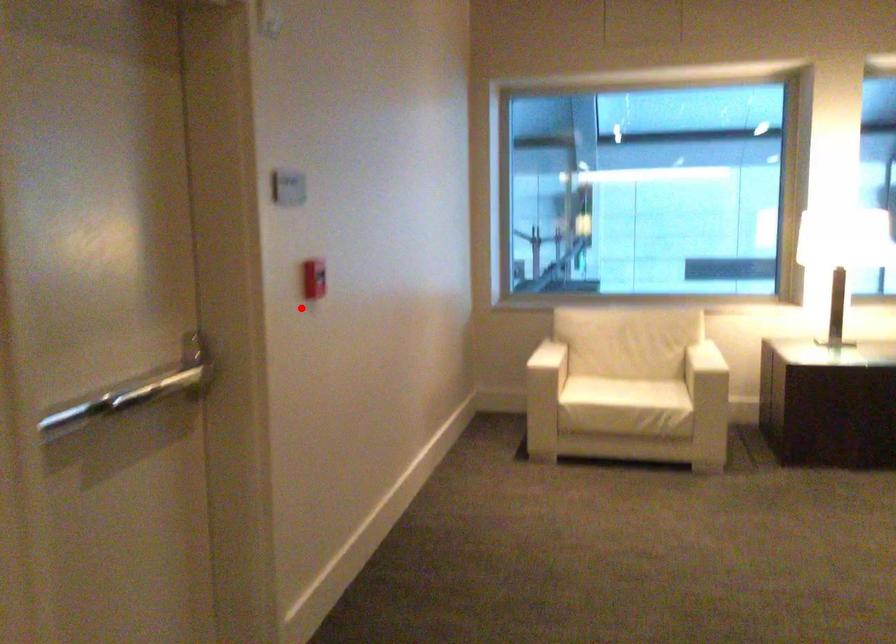
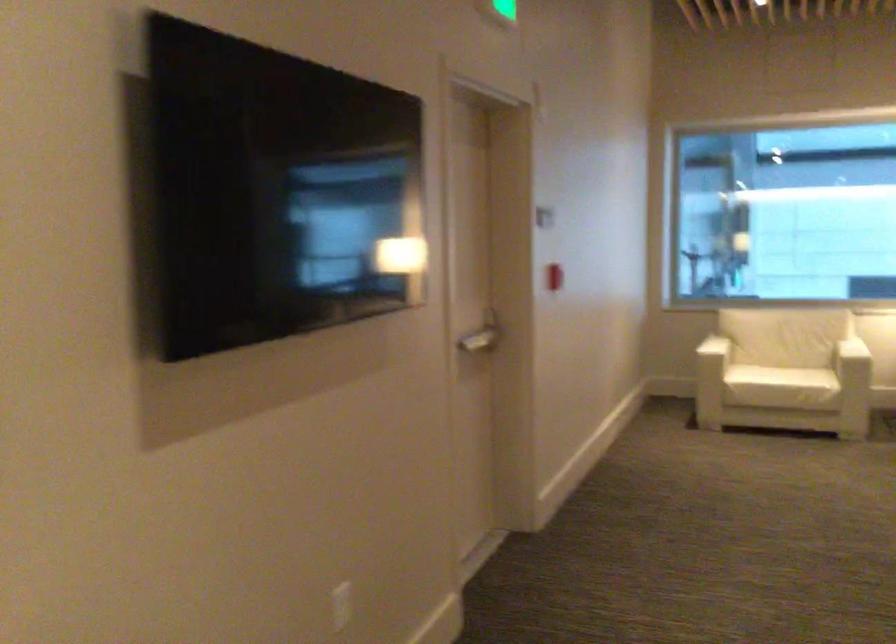
Question: I am providing you with two images of the same scene from different viewpoints. Given a red point in image1, look at the same physical point in image2. Is it:

Choices:
 (A) Closer to the viewpoint
 (B) Farther from the viewpoint

Answer: (B)